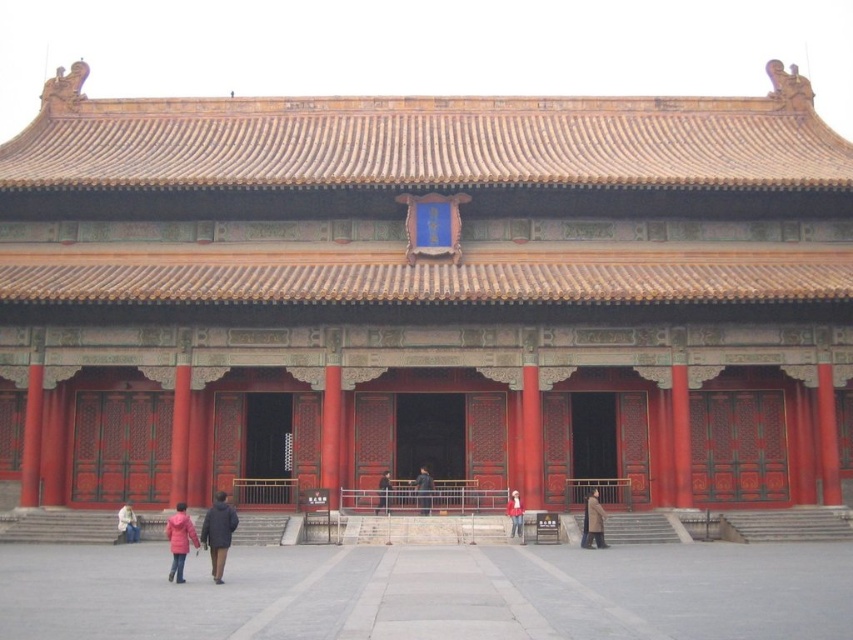
Who is positioned more to the right, pink fabric coat at lower center or dark gray fabric coat at center?

From the viewer's perspective, dark gray fabric coat at center appears more on the right side.

Who is more distant from viewer, (167, 538) or (419, 509)?

The point (419, 509) is more distant.

I want to click on pink fabric coat at lower center, so click(178, 540).

Is white matte jacket at lower left positioned at the back of black leather jacket at center?

No, white matte jacket at lower left is in front of black leather jacket at center.

This screenshot has width=853, height=640. In order to click on white matte jacket at lower left in this screenshot , I will do `click(126, 524)`.

Which is above, red fabric jacket at center or black leather jacket at center?

Positioned higher is black leather jacket at center.

What do you see at coordinates (515, 513) in the screenshot?
I see `red fabric jacket at center` at bounding box center [515, 513].

You are a GUI agent. You are given a task and a screenshot of the screen. Output one action in this format:
    pyautogui.click(x=<x>, y=<y>)
    Task: Click on the red fabric jacket at center
    This screenshot has height=640, width=853.
    Given the screenshot: What is the action you would take?
    pyautogui.click(x=515, y=513)